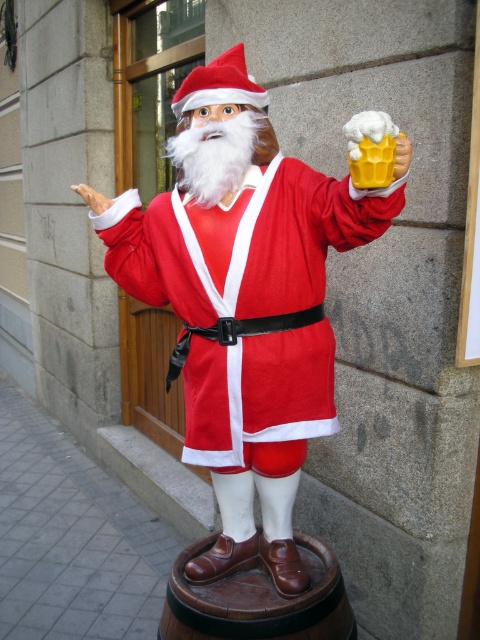
Question: Which point appears farthest from the camera in this image?

Choices:
 (A) (397, 140)
 (B) (214, 444)
 (C) (85, 202)

Answer: (C)

Question: Can you confirm if matte red santa claus at center is thinner than yellow matte beer mug at upper center?

Choices:
 (A) no
 (B) yes

Answer: (A)

Question: Does matte red santa claus at center appear over yellow matte beer mug at upper center?

Choices:
 (A) no
 (B) yes

Answer: (A)

Question: Which object is the closest to the white matte hand at upper center?

Choices:
 (A) yellow matte beer mug at upper center
 (B) matte red santa claus at center

Answer: (B)

Question: Among these objects, which one is farthest from the camera?

Choices:
 (A) matte red santa claus at center
 (B) white matte hand at upper center
 (C) yellow matte beer mug at upper center

Answer: (B)

Question: Does matte red santa claus at center appear on the left side of white matte hand at upper center?

Choices:
 (A) yes
 (B) no

Answer: (B)